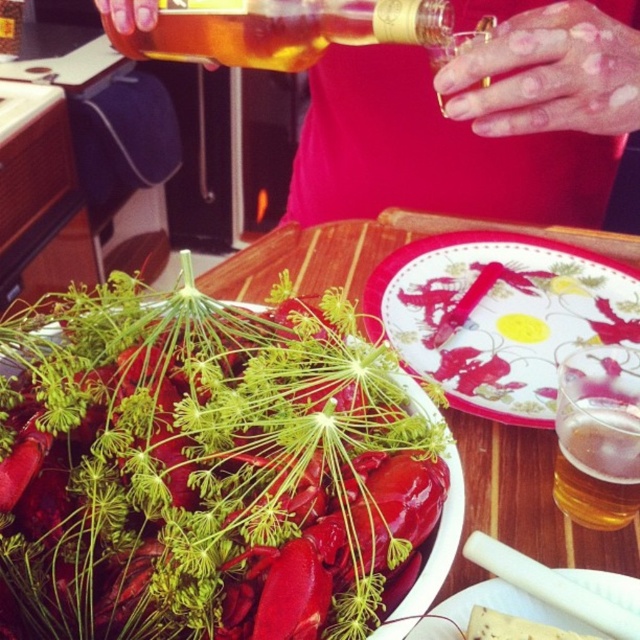
Question: Which object is closer to the camera taking this photo?

Choices:
 (A) amber glass bottle at upper center
 (B) white glossy plate at center

Answer: (A)

Question: Estimate the real-world distances between objects in this image. Which object is farther from the white ceramic plate at center?

Choices:
 (A) amber glass bottle at upper center
 (B) shiny red lobster at center
 (C) white glossy plate at center
 (D) smooth plastic bottle at upper center

Answer: (D)

Question: Based on their relative distances, which object is farther from the smooth plastic bottle at upper center?

Choices:
 (A) shiny red lobster at center
 (B) white glossy plate at center
 (C) translucent glass beer at upper right

Answer: (C)

Question: Does white glossy plate at center appear over white ceramic plate at center?

Choices:
 (A) yes
 (B) no

Answer: (A)

Question: Can you confirm if shiny red lobster at center is positioned to the right of translucent glass beer at upper right?

Choices:
 (A) no
 (B) yes

Answer: (A)

Question: Is white glossy plate at center positioned in front of white ceramic plate at center?

Choices:
 (A) yes
 (B) no

Answer: (B)